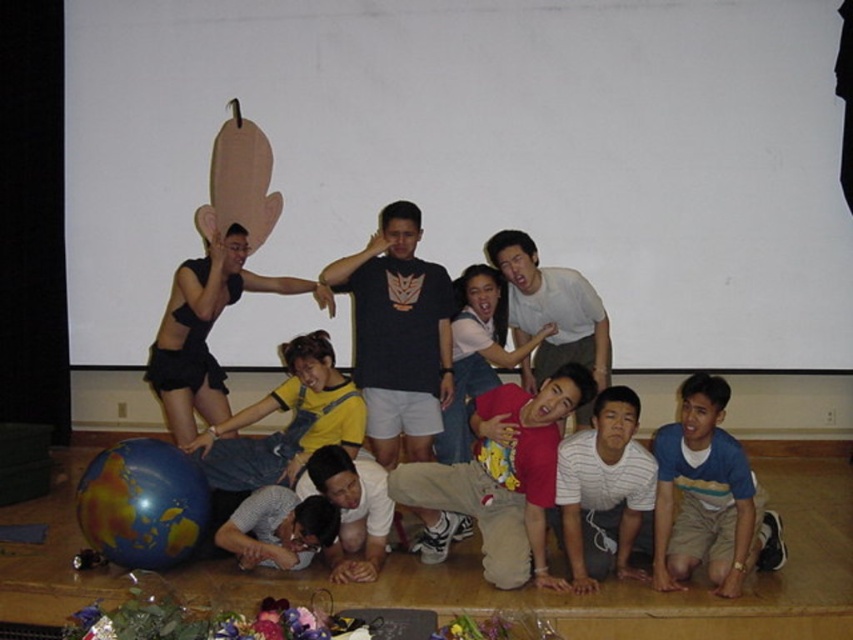
You are standing on the stage and want to move from the point at coordinates point (514, 509) to the point at coordinates point (167, 364). Which direction should you move to get closer to the latter point?

To move from point (514, 509) to point (167, 364), you should move towards the lower left direction since point (167, 364) is located behind point (514, 509).

You are standing at the center of the stage and want to touch the point at coordinates point (706, 497). Which object in the scene should you move towards to reach that point?

The point (706, 497) is located on the blue striped shirt at lower right, so you should move towards the blue striped shirt at lower right to reach that point.

You are a photographer trying to capture a photo of the matte red shirt at center and the blue striped shirt at lower right. Which of the two shirts is positioned higher in the image?

The matte red shirt at center is positioned higher than the blue striped shirt at lower right because it is located above it.